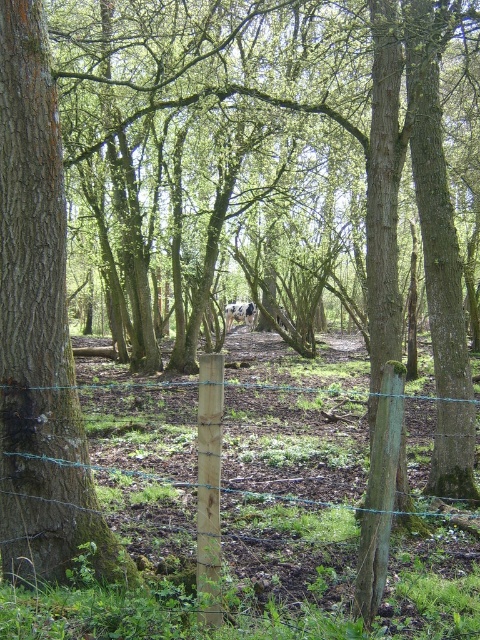
You are a hiker who has just entered the forest and see the green wire fence at center. If you want to take a photo of the fence from a position where it is exactly in the center of your viewfinder, where should you stand relative to the fence?

Since the green wire fence at center is located at point 0.787 on the x and 0.458 on the y coordinates, you should position yourself directly in front of the fence at its central point to ensure it remains centered in your viewfinder.

You are a hiker who wants to take a photo of the green wire fence at center and the rough bark tree at center. Which object should you focus on first if you want both to be in clear focus?

The rough bark tree at center should be focused on first because it is smaller in size than the green wire fence at center, allowing for a greater depth of field to include both objects clearly.

From the picture: You are standing in the woodland scene and notice a wooden post with a wire fence. There is a specific point marked at coordinates (219, 502). Can you determine if this point is located on the green wire fence at center?

The point at (219, 502) is on the green wire fence at center, so yes, it is located on the fence.